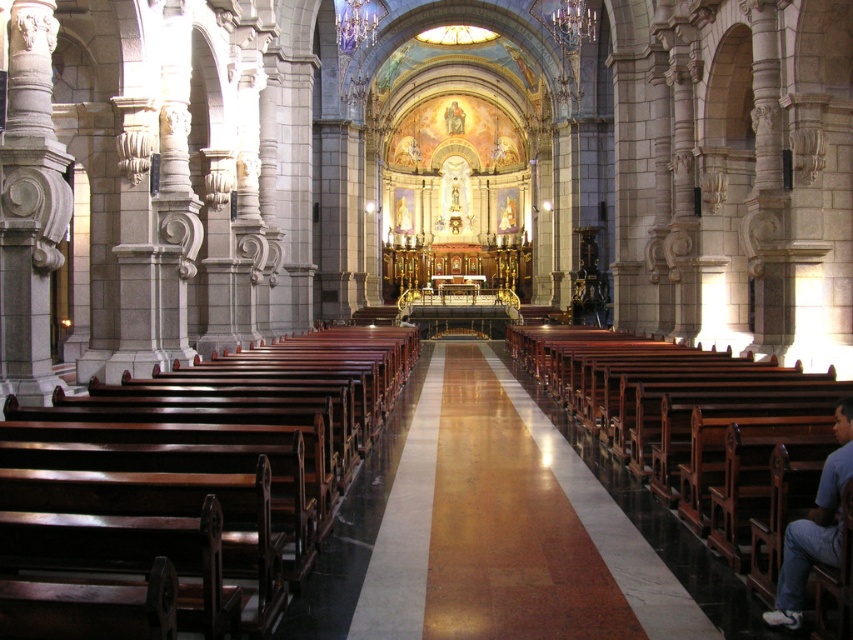
You are an interior designer planning to place a 1.8 meter tall statue in the cathedral. You notice two benches at the center. Which bench, the polished dark wood bench at center or the polished wood bench at center, is shorter and thus more suitable for the statue to be placed behind it without blocking the view?

The polished dark wood bench at center is shorter than the polished wood bench at center, so placing the statue behind it would be more suitable as it won not block the view as much.

You are standing in the cathedral and want to sit down. You see a polished dark wood bench at center and a blue cotton shirt at lower right. Which object is closer to the left side of the cathedral?

The polished dark wood bench at center is to the left of the blue cotton shirt at lower right, so it is closer to the left side of the cathedral.

You are standing at the entrance of the cathedral and want to sit on the polished wood bench at center. Based on its location coordinates, is the bench closer to the altar or the entrance?

The polished wood bench at center is located at point (685, 442). Since the coordinates are closer to 1 on the y axis, it is closer to the altar than the entrance.